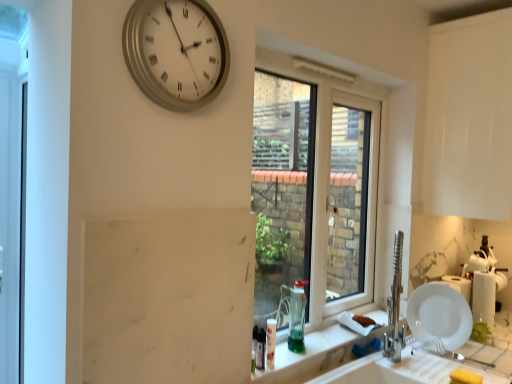
Identify the location of free spot above white plastic window at center (from a real-world perspective). This screenshot has height=384, width=512. (329, 70).